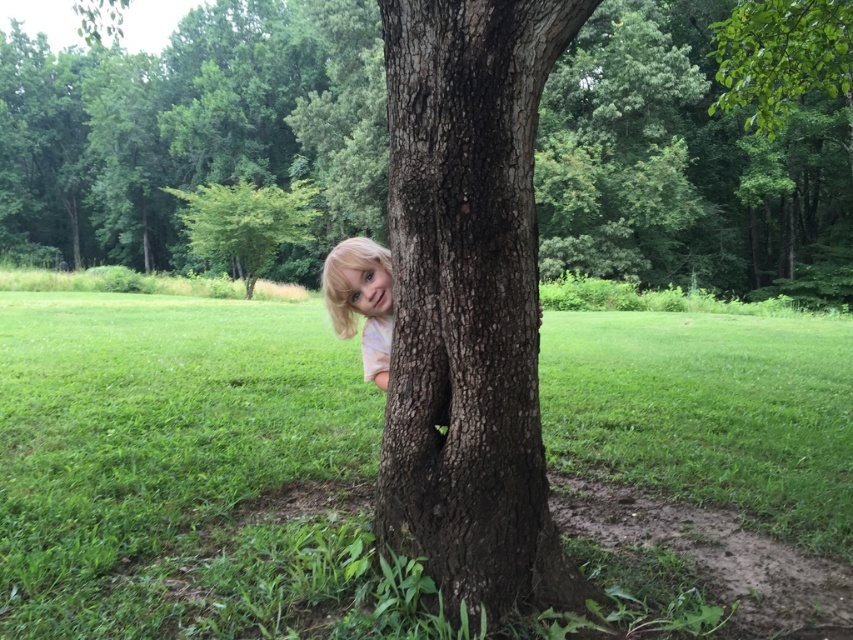
Question: Which point appears farthest from the camera in this image?

Choices:
 (A) (386, 512)
 (B) (109, 209)
 (C) (375, 273)
 (D) (196, 204)

Answer: (B)

Question: Does green leafy bush at upper left have a lesser width compared to blonde hair at tree?

Choices:
 (A) no
 (B) yes

Answer: (A)

Question: Which of the following is the farthest from the observer?

Choices:
 (A) (440, 20)
 (B) (289, 234)
 (C) (335, 273)

Answer: (B)

Question: Is brown rough tree trunk at center to the left of blonde hair at tree from the viewer's perspective?

Choices:
 (A) no
 (B) yes

Answer: (A)

Question: Is brown rough tree trunk at center to the left of green leafy bush at upper left from the viewer's perspective?

Choices:
 (A) yes
 (B) no

Answer: (B)

Question: Among these points, which one is nearest to the camera?

Choices:
 (A) (216, 200)
 (B) (347, 333)
 (C) (93, 163)
 (D) (402, 276)

Answer: (D)